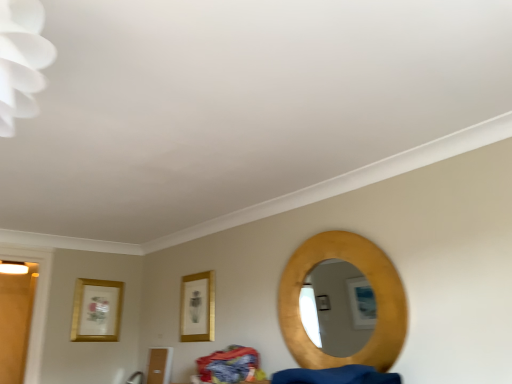
Question: From a real-world perspective, is gold metallic picture frame at left, which is counted as the 2th picture frame, starting from the front, below gold metallic picture frame at center, the 1th picture frame in the front-to-back sequence?

Choices:
 (A) yes
 (B) no

Answer: (B)

Question: Is gold metallic picture frame at left, the 1th picture frame positioned from the left, outside gold metallic picture frame at center, arranged as the first picture frame when viewed from the right?

Choices:
 (A) yes
 (B) no

Answer: (A)

Question: Is gold metallic picture frame at left, the 1th picture frame positioned from the left, facing towards gold metallic picture frame at center, the 1th picture frame in the front-to-back sequence?

Choices:
 (A) no
 (B) yes

Answer: (B)

Question: Does gold metallic picture frame at left, which is counted as the 2th picture frame, starting from the front, contain gold metallic picture frame at center, the 1th picture frame in the front-to-back sequence?

Choices:
 (A) yes
 (B) no

Answer: (B)

Question: Considering the relative positions of gold metallic picture frame at left, which is the first picture frame in back-to-front order, and gold metallic picture frame at center, the 1th picture frame in the front-to-back sequence, in the image provided, is gold metallic picture frame at left, which is the first picture frame in back-to-front order, to the left of gold metallic picture frame at center, the 1th picture frame in the front-to-back sequence, from the viewer's perspective?

Choices:
 (A) yes
 (B) no

Answer: (A)

Question: Is gold textured mirror at right in front of or behind gold metallic picture frame at center, the second picture frame when ordered from left to right, in the image?

Choices:
 (A) front
 (B) behind

Answer: (A)

Question: Based on their positions, is gold textured mirror at right located to the left or right of gold metallic picture frame at center, the 1th picture frame in the front-to-back sequence?

Choices:
 (A) right
 (B) left

Answer: (A)

Question: Based on their sizes in the image, would you say gold textured mirror at right is bigger or smaller than gold metallic picture frame at center, the 2th picture frame in the back-to-front sequence?

Choices:
 (A) big
 (B) small

Answer: (A)

Question: From a real-world perspective, is gold textured mirror at right physically located above or below gold metallic picture frame at center, the 2th picture frame in the back-to-front sequence?

Choices:
 (A) above
 (B) below

Answer: (B)

Question: From the image's perspective, is gold metallic picture frame at left, the 1th picture frame positioned from the left, located above or below gold textured mirror at right?

Choices:
 (A) below
 (B) above

Answer: (A)

Question: Is gold metallic picture frame at left, which is counted as the 2th picture frame, starting from the front, in front of or behind gold textured mirror at right in the image?

Choices:
 (A) behind
 (B) front

Answer: (A)

Question: Is point (95, 337) positioned closer to the camera than point (292, 279)?

Choices:
 (A) farther
 (B) closer

Answer: (A)

Question: Considering the relative positions of gold metallic picture frame at left, the second picture frame from the right, and gold textured mirror at right in the image provided, is gold metallic picture frame at left, the second picture frame from the right, to the left or to the right of gold textured mirror at right?

Choices:
 (A) left
 (B) right

Answer: (A)

Question: In the image, is gold metallic picture frame at center, the 1th picture frame in the front-to-back sequence, positioned in front of or behind gold textured mirror at right?

Choices:
 (A) behind
 (B) front

Answer: (A)

Question: Is gold metallic picture frame at center, arranged as the first picture frame when viewed from the right, spatially inside gold textured mirror at right, or outside of it?

Choices:
 (A) inside
 (B) outside

Answer: (B)